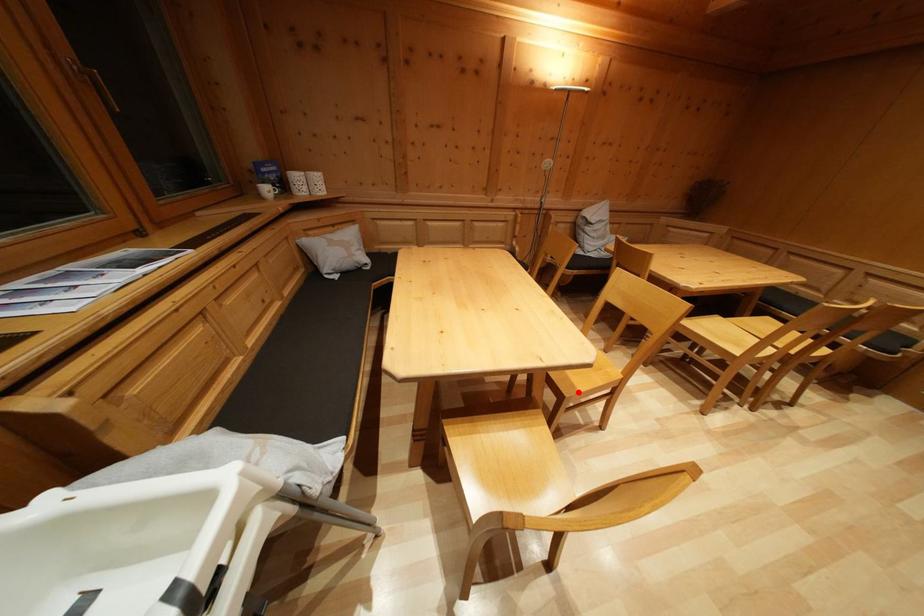
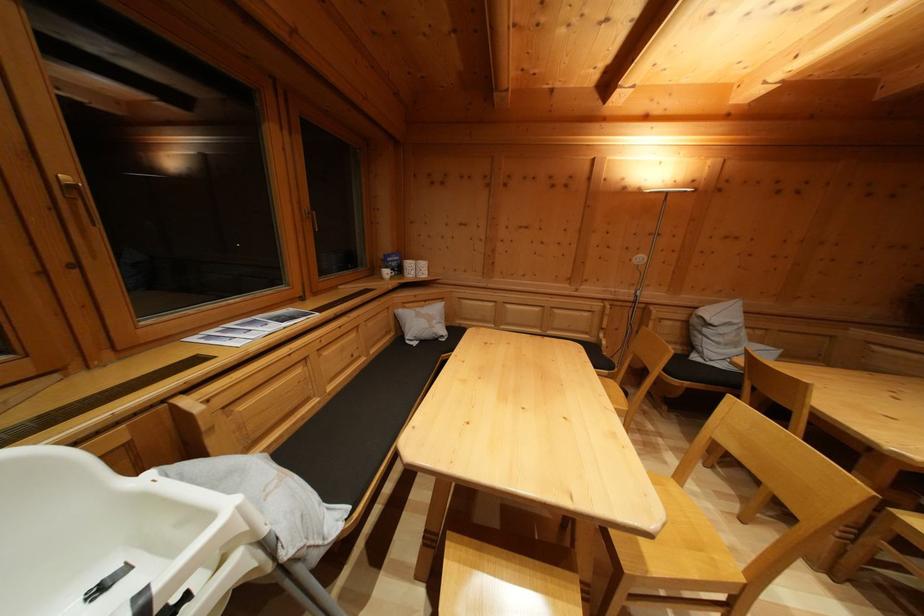
Question: A red point is marked in image1. In image2, is the corresponding 3D point closer to the camera or farther? Reply with the corresponding letter.

Choices:
 (A) The corresponding 3D point is closer.
 (B) The corresponding 3D point is farther.

Answer: (A)